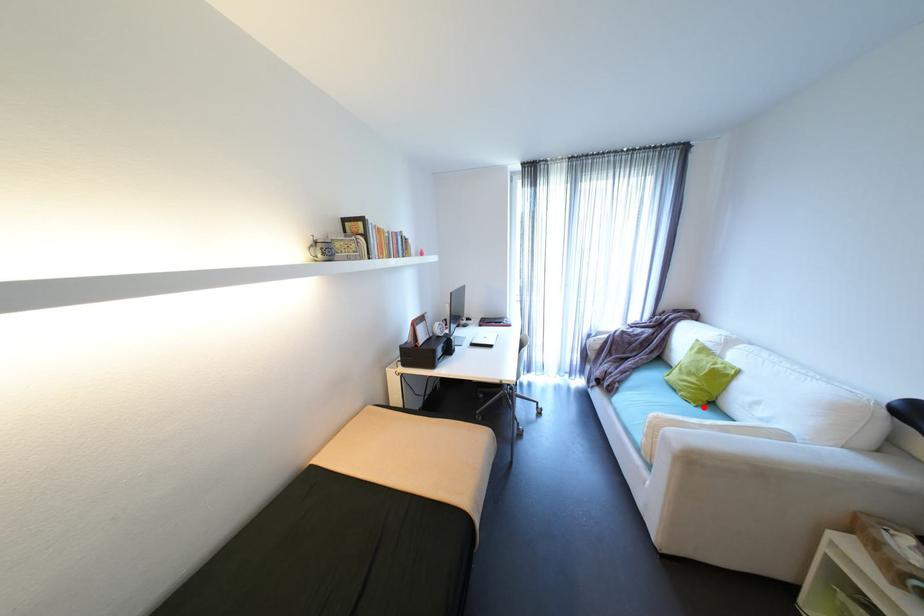
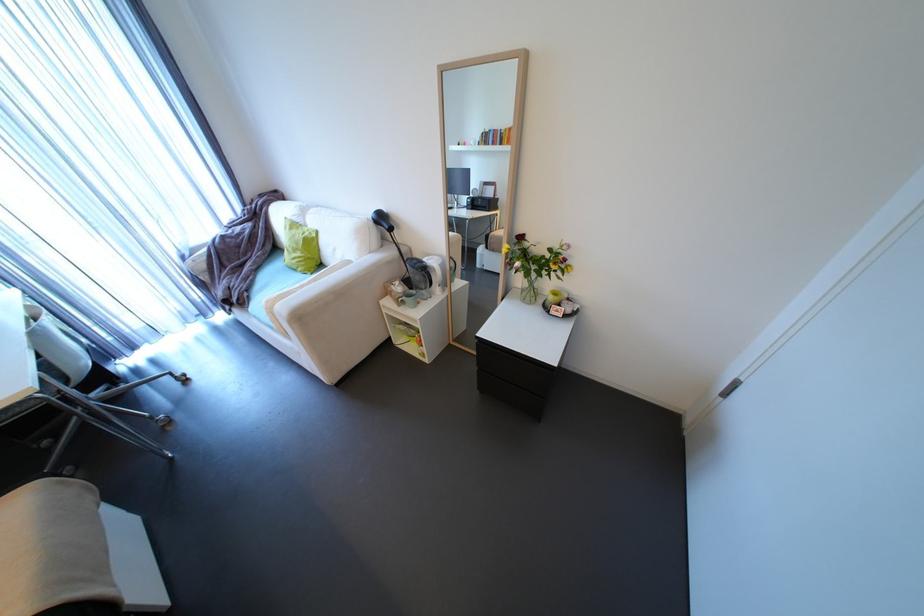
Question: A red point is marked in image1. In image2, is the corresponding 3D point closer to the camera or farther? Reply with the corresponding letter.

Choices:
 (A) The corresponding 3D point is closer.
 (B) The corresponding 3D point is farther.

Answer: (B)